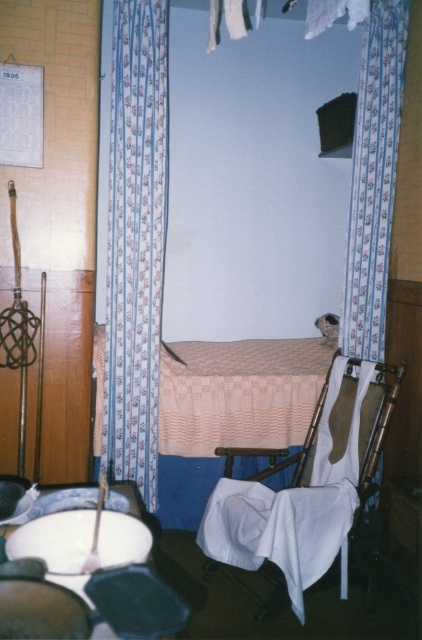
You are standing in the room and want to sit on the wooden rocking chair at center. Based on its coordinates, where exactly should you walk to?

The wooden rocking chair at center is located at coordinates point (x=308, y=486), so you should walk to that point to sit on it.

You are trying to decide whether to place a small potted plant between the wooden rocking chair at center and the beige woven blanket at center. Based on their heights, which object should the plant be placed closer to?

The wooden rocking chair at center is much taller than the beige woven blanket at center, so the plant should be placed closer to the beige woven blanket at center to avoid being overshadowed by the taller chair.